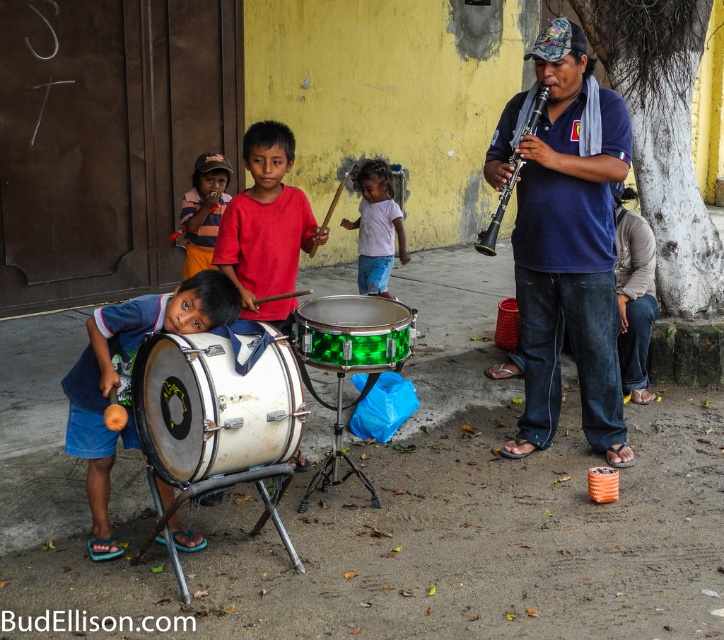
Based on the photo, you are a photographer trying to capture the matte white drum at lower left in the center of your photo. Given its 2D coordinates at point 0.591, 0.178, would you need to pan your camera to the left or right to center it?

The matte white drum at lower left is located at coordinates 0.591 on the x axis and 0.178 on the y axis. Since the x coordinate is 0.591, which is slightly to the right of the center point of 0.5, you would need to pan your camera slightly to the left to bring it into the center.

Looking at this image, you are a photographer trying to capture the entire scene. You notice the matte white drum at lower left and the black plastic clarinet at center. Which object should you focus on first if you want to ensure both are in sharp focus?

The matte white drum at lower left is located below the black plastic clarinet at center. To ensure both are in sharp focus, you should focus on the black plastic clarinet at center first since it is closer to the camera and occupies a central position in the frame.